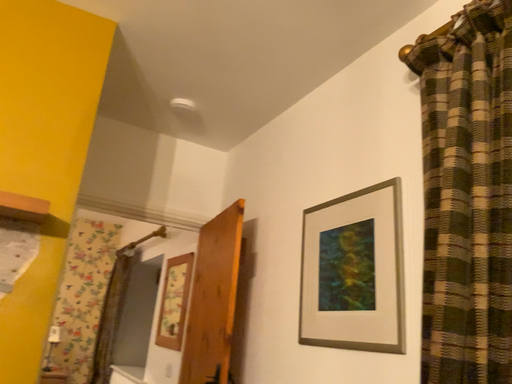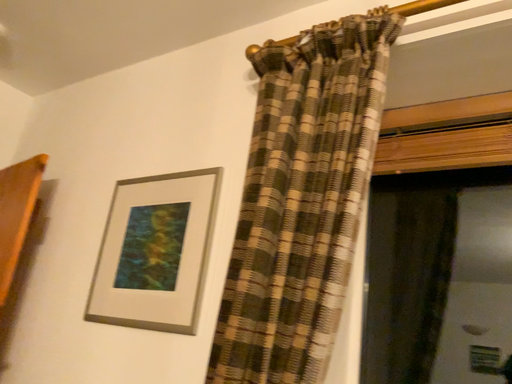
Question: How did the camera likely rotate when shooting the video?

Choices:
 (A) rotated right
 (B) rotated left

Answer: (A)